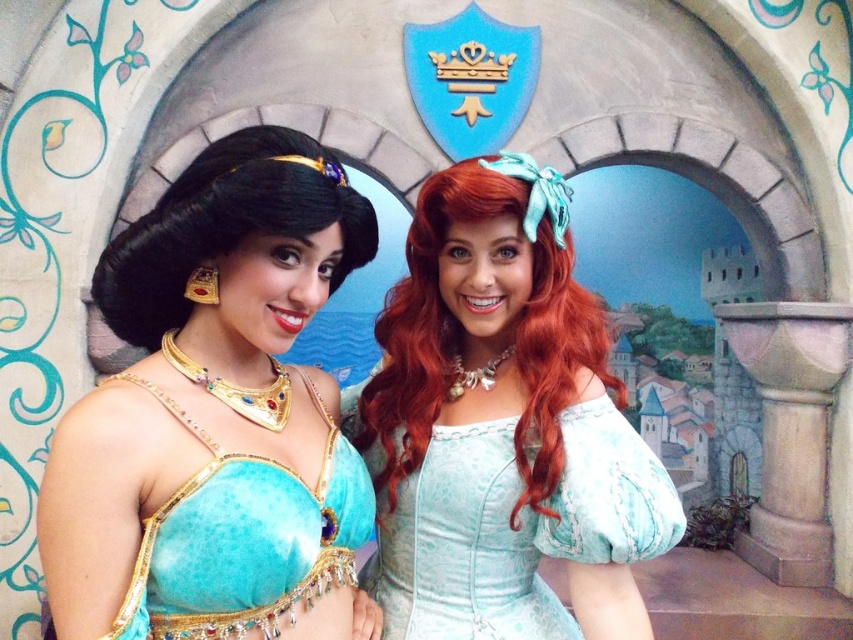
Question: Which point is closer to the camera?

Choices:
 (A) turquoise velvet top at center
 (B) matte blue fabric dress at left
 (C) matte teal dress at center

Answer: (A)

Question: Which is nearer to the matte teal dress at center?

Choices:
 (A) turquoise velvet top at center
 (B) matte blue fabric dress at left

Answer: (B)

Question: Observing the image, what is the correct spatial positioning of matte teal dress at center in reference to turquoise velvet top at center?

Choices:
 (A) left
 (B) right

Answer: (B)

Question: Among these objects, which one is farthest from the camera?

Choices:
 (A) turquoise velvet top at center
 (B) matte teal dress at center
 (C) matte blue fabric dress at left

Answer: (B)

Question: Is matte blue fabric dress at left below turquoise velvet top at center?

Choices:
 (A) yes
 (B) no

Answer: (B)

Question: Is matte teal dress at center to the left of turquoise velvet top at center from the viewer's perspective?

Choices:
 (A) no
 (B) yes

Answer: (A)